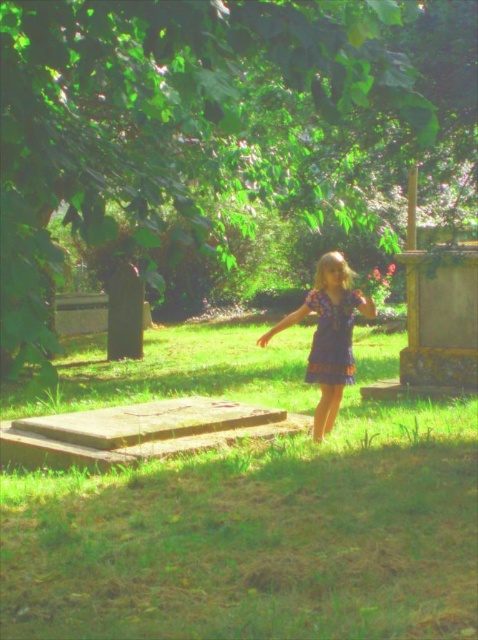
Question: Which point is farther to the camera?

Choices:
 (A) green grass at center
 (B) purple cotton dress at center
 (C) blue lace dress at center

Answer: (B)

Question: Is green grass at center bigger than blue lace dress at center?

Choices:
 (A) no
 (B) yes

Answer: (B)

Question: Which object is positioned farthest from the green grass at center?

Choices:
 (A) blue lace dress at center
 (B) purple cotton dress at center

Answer: (B)

Question: Is green grass at center positioned behind purple cotton dress at center?

Choices:
 (A) no
 (B) yes

Answer: (A)

Question: Can you confirm if purple cotton dress at center is positioned to the right of blue lace dress at center?

Choices:
 (A) no
 (B) yes

Answer: (A)

Question: Which point is farther to the camera?

Choices:
 (A) (315, 284)
 (B) (314, 339)
 (C) (264, 532)

Answer: (A)